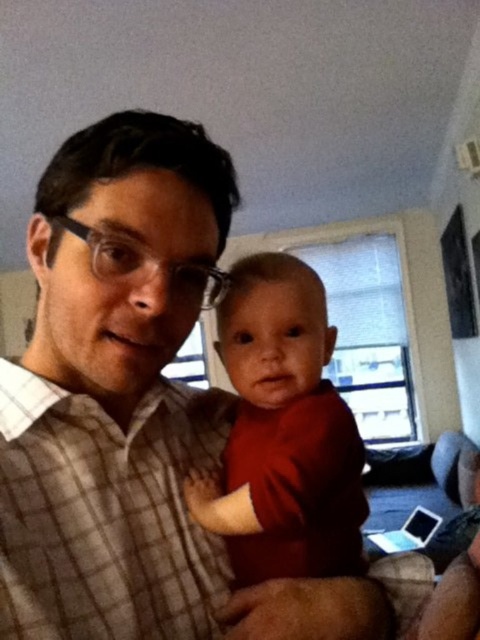
Question: Which object is closer to the camera taking this photo?

Choices:
 (A) matte red shirt at center
 (B) plaid shirt at center

Answer: (B)

Question: Can you confirm if plaid shirt at center is wider than matte red shirt at center?

Choices:
 (A) yes
 (B) no

Answer: (A)

Question: Does plaid shirt at center appear under matte red shirt at center?

Choices:
 (A) yes
 (B) no

Answer: (B)

Question: Does plaid shirt at center appear on the right side of matte red shirt at center?

Choices:
 (A) no
 (B) yes

Answer: (A)

Question: Which object is farther from the camera taking this photo?

Choices:
 (A) matte red shirt at center
 (B) plaid shirt at center

Answer: (A)